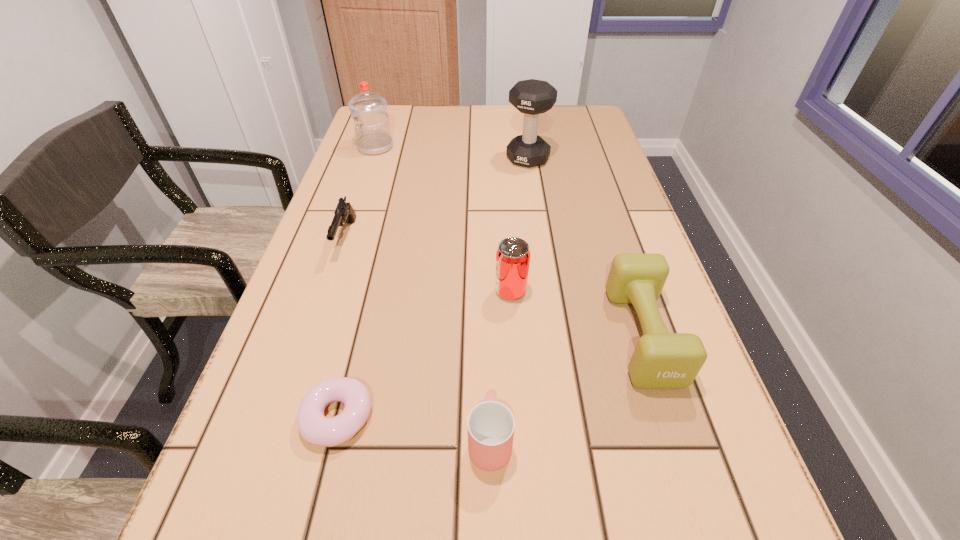
Identify the location of free space that is in between the cup and the fifth shortest object. The width and height of the screenshot is (960, 540). (500, 366).

Image resolution: width=960 pixels, height=540 pixels. What are the coordinates of `vacant area that lies between the farther dumbbell and the soda can` in the screenshot? It's located at (519, 225).

Find the location of a particular element. empty space that is in between the nearer dumbbell and the fifth shortest object is located at coordinates (577, 313).

At what (x,y) coordinates should I click in order to perform the action: click on vacant area that lies between the cup and the doughnut. Please return your answer as a coordinate pair (x, y). This screenshot has width=960, height=540. Looking at the image, I should click on (414, 429).

Locate an element on the screen. The image size is (960, 540). unoccupied area between the water bottle and the doughnut is located at coordinates (356, 282).

You are a GUI agent. You are given a task and a screenshot of the screen. Output one action in this format:
    pyautogui.click(x=<x>, y=<y>)
    Task: Click on the vacant area between the soda can and the shortest object
    
    Given the screenshot: What is the action you would take?
    pyautogui.click(x=424, y=354)

At what (x,y) coordinates should I click in order to perform the action: click on object that is the second closest to the shortest object. Please return your answer as a coordinate pair (x, y). This screenshot has height=540, width=960. Looking at the image, I should click on (513, 255).

This screenshot has width=960, height=540. In order to click on object that can be found as the second closest to the farther dumbbell in this screenshot , I will do `click(344, 213)`.

In order to click on dumbbell that is the closest to the soda can in this screenshot , I will do `click(661, 360)`.

Identify the location of vacant area that satisfies the following two spatial constraints: 1. at the end of the barrel of the third tallest object; 2. on the left side of the gun. pos(328,292).